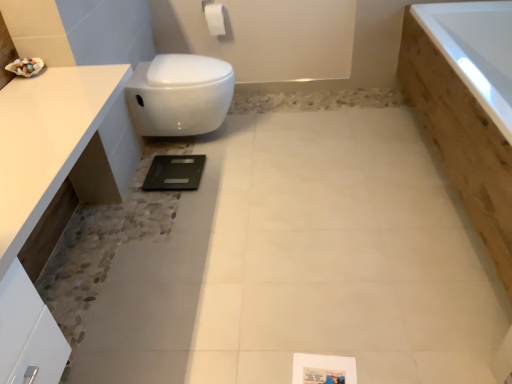
Question: Is white matte toilet paper at upper center facing away from white glossy countertop at upper left?

Choices:
 (A) yes
 (B) no

Answer: (B)

Question: From a real-world perspective, is white matte toilet paper at upper center located higher than white glossy countertop at upper left?

Choices:
 (A) no
 (B) yes

Answer: (B)

Question: Is white matte toilet paper at upper center in contact with white glossy countertop at upper left?

Choices:
 (A) no
 (B) yes

Answer: (A)

Question: Can you confirm if white matte toilet paper at upper center is smaller than white glossy countertop at upper left?

Choices:
 (A) yes
 (B) no

Answer: (A)

Question: From the image's perspective, does white matte toilet paper at upper center appear lower than white glossy countertop at upper left?

Choices:
 (A) no
 (B) yes

Answer: (A)

Question: Based on their sizes in the image, would you say white glossy toilet at upper left is bigger or smaller than white matte toilet paper at upper center?

Choices:
 (A) big
 (B) small

Answer: (A)

Question: From a real-world perspective, relative to white matte toilet paper at upper center, is white glossy toilet at upper left vertically above or below?

Choices:
 (A) above
 (B) below

Answer: (B)

Question: Considering the relative positions of white glossy toilet at upper left and white matte toilet paper at upper center in the image provided, is white glossy toilet at upper left to the left or to the right of white matte toilet paper at upper center?

Choices:
 (A) left
 (B) right

Answer: (A)

Question: Considering the positions of white glossy toilet at upper left and white matte toilet paper at upper center in the image, is white glossy toilet at upper left taller or shorter than white matte toilet paper at upper center?

Choices:
 (A) tall
 (B) short

Answer: (A)

Question: Does point (55, 178) appear closer or farther from the camera than point (208, 16)?

Choices:
 (A) farther
 (B) closer

Answer: (B)

Question: Is white glossy countertop at upper left wider or thinner than white matte toilet paper at upper center?

Choices:
 (A) wide
 (B) thin

Answer: (A)

Question: From the image's perspective, is white glossy countertop at upper left above or below white matte toilet paper at upper center?

Choices:
 (A) above
 (B) below

Answer: (B)

Question: In terms of height, does white glossy countertop at upper left look taller or shorter compared to white matte toilet paper at upper center?

Choices:
 (A) short
 (B) tall

Answer: (B)

Question: Relative to white glossy countertop at upper left, is white matte toilet paper at upper center in front or behind?

Choices:
 (A) behind
 (B) front

Answer: (A)

Question: In terms of width, does white matte toilet paper at upper center look wider or thinner when compared to white glossy countertop at upper left?

Choices:
 (A) wide
 (B) thin

Answer: (B)